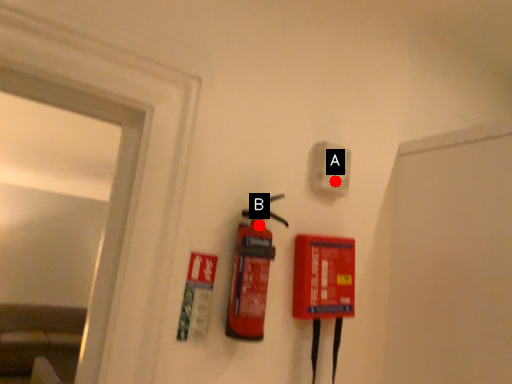
Question: Two points are circled on the image, labeled by A and B beside each circle. Which point is closer to the camera?

Choices:
 (A) A is closer
 (B) B is closer

Answer: (B)